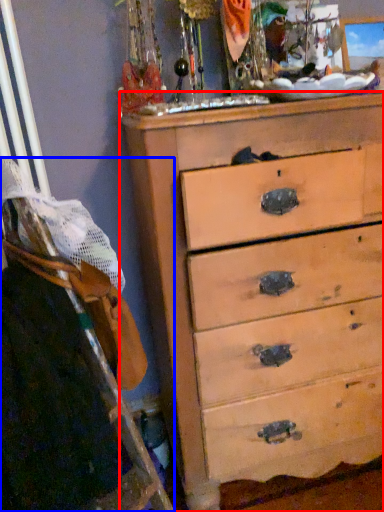
Question: Which object is further to the camera taking this photo, chest of drawers (highlighted by a red box) or ladder (highlighted by a blue box)?

Choices:
 (A) chest of drawers
 (B) ladder

Answer: (A)